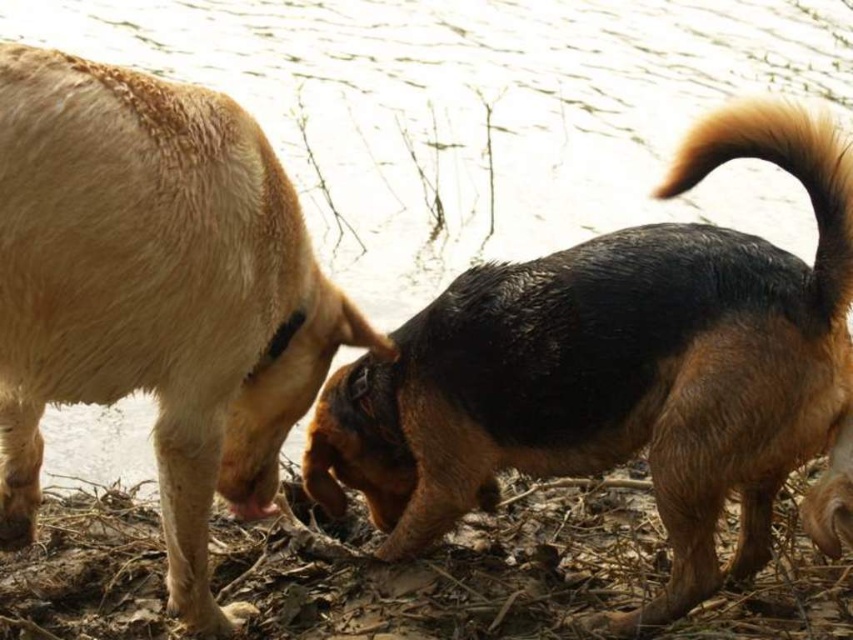
Between point (846, 262) and point (692, 168), which one is positioned in front?

Point (846, 262) is more forward.

Is point (846, 227) farther from viewer compared to point (831, 301)?

No, (846, 227) is in front of (831, 301).

The image size is (853, 640). I want to click on brown fur dog at right, so click(624, 372).